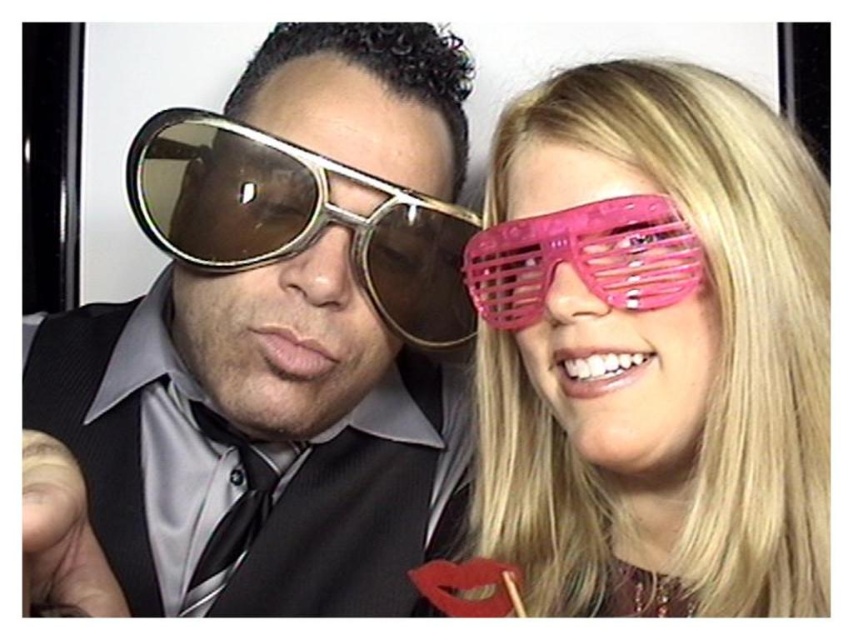
Can you confirm if pink plastic glasses at right is positioned to the right of gold reflective sunglasses at left?

Yes, pink plastic glasses at right is to the right of gold reflective sunglasses at left.

Can you confirm if pink plastic glasses at right is taller than gold reflective sunglasses at left?

Indeed, pink plastic glasses at right has a greater height compared to gold reflective sunglasses at left.

Which is behind, point (723, 80) or point (294, 195)?

The point (294, 195) is more distant.

The image size is (853, 640). I want to click on pink plastic glasses at right, so click(653, 349).

What do you see at coordinates (279, 339) in the screenshot? The image size is (853, 640). I see `metallic gold sunglasses at left` at bounding box center [279, 339].

Where is `metallic gold sunglasses at left`? The height and width of the screenshot is (640, 853). metallic gold sunglasses at left is located at coordinates click(x=279, y=339).

This screenshot has height=640, width=853. What are the coordinates of `metallic gold sunglasses at left` in the screenshot? It's located at (279, 339).

Does metallic gold sunglasses at left appear under pink plastic glasses at right?

No.

Can you confirm if metallic gold sunglasses at left is shorter than pink plastic glasses at right?

No.

This screenshot has width=853, height=640. Describe the element at coordinates (279, 339) in the screenshot. I see `metallic gold sunglasses at left` at that location.

Find the location of a particular element. The image size is (853, 640). metallic gold sunglasses at left is located at coordinates (279, 339).